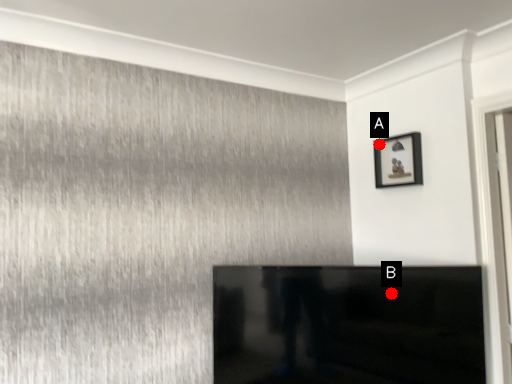
Question: Two points are circled on the image, labeled by A and B beside each circle. Which point appears farthest from the camera in this image?

Choices:
 (A) A is further
 (B) B is further

Answer: (A)